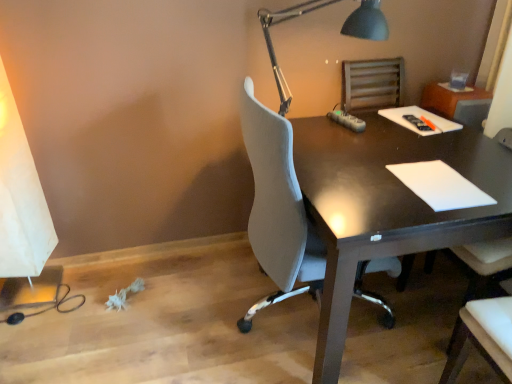
Question: From the image's perspective, is white matte notepad at right located above or below dark wood desk at center?

Choices:
 (A) above
 (B) below

Answer: (A)

Question: Looking at their shapes, would you say white matte notepad at right is wider or thinner than dark wood desk at center?

Choices:
 (A) wide
 (B) thin

Answer: (B)

Question: Estimate the real-world distances between objects in this image. Which object is closer to the metallic gray desk lamp at upper right?

Choices:
 (A) dark wood desk at center
 (B) white matte notepad at right

Answer: (A)

Question: Which of these objects is positioned farthest from the metallic gray desk lamp at upper right?

Choices:
 (A) white matte notepad at right
 (B) dark wood desk at center

Answer: (A)